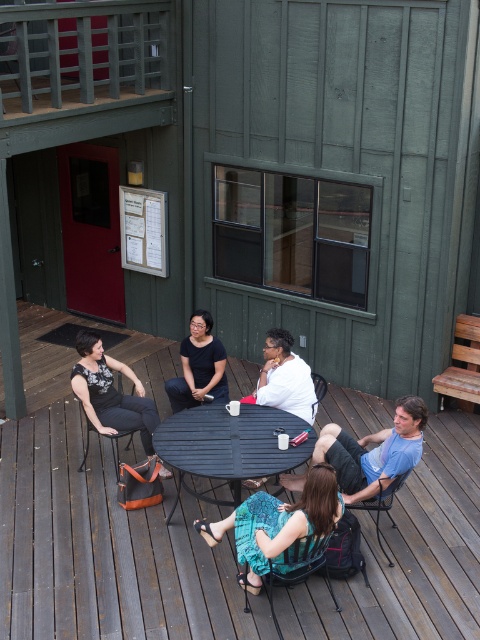
You are sitting at the table in the scene and want to move to the matte black chair at lower left. Which direction should you move relative to the metallic silver chair at center?

To reach the matte black chair at lower left, you should move downward from the metallic silver chair at center since the matte black chair at lower left is located below it.